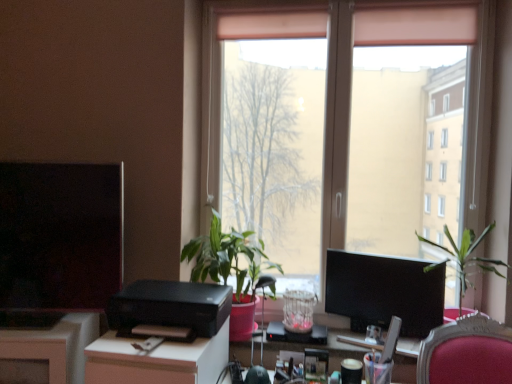
Locate an element on the screen. This screenshot has width=512, height=384. matte black monitor at left, which appears as the 2th computer monitor when viewed from the right is located at coordinates (60, 235).

Measure the distance between matte black monitor at center right, acting as the 1th computer monitor starting from the right, and camera.

matte black monitor at center right, acting as the 1th computer monitor starting from the right, and camera are 6.18 feet apart.

In order to face matte black monitor at center right, acting as the 1th computer monitor starting from the right, should I rotate leftwards or rightwards?

A 16.407 degree turn to the right will do.

Where is `green leafy plant at right, which is counted as the 2th houseplant, starting from the left`? green leafy plant at right, which is counted as the 2th houseplant, starting from the left is located at coordinates (465, 257).

The image size is (512, 384). What are the coordinates of `black plastic computer desk at center` in the screenshot? It's located at (320, 348).

What is the approximate height of black plastic computer desk at center?

The height of black plastic computer desk at center is 1.37 inches.

Locate an element on the screen. Image resolution: width=512 pixels, height=384 pixels. matte black monitor at left, which appears as the 2th computer monitor when viewed from the right is located at coordinates (60, 235).

Between matte black monitor at center right, which is the second computer monitor in left-to-right order, and green leafy plant at right, the 1th houseplant in the right-to-left sequence, which one has more height?

green leafy plant at right, the 1th houseplant in the right-to-left sequence, is taller.

Find the location of `the 1st computer monitor to the left of the green leafy plant at right, which is counted as the 2th houseplant, starting from the left, counting from the anchor's position`. the 1st computer monitor to the left of the green leafy plant at right, which is counted as the 2th houseplant, starting from the left, counting from the anchor's position is located at coordinates (385, 292).

Is matte black monitor at center right, which is the second computer monitor in left-to-right order, further to camera compared to green leafy plant at right, which is counted as the 2th houseplant, starting from the left?

Yes, matte black monitor at center right, which is the second computer monitor in left-to-right order, is further from the viewer.

From the image's perspective, between translucent glass vase at center and matte black monitor at center right, which is the second computer monitor in left-to-right order, which one is located above?

matte black monitor at center right, which is the second computer monitor in left-to-right order.

Is translucent glass vase at center placed right next to matte black monitor at center right, acting as the 1th computer monitor starting from the right?

They are not placed beside each other.

Which object is closer to the camera, translucent glass vase at center or matte black monitor at center right, which is the second computer monitor in left-to-right order?

Positioned in front is matte black monitor at center right, which is the second computer monitor in left-to-right order.

From a real-world perspective, does translucent glass vase at center stand above matte black monitor at center right, acting as the 1th computer monitor starting from the right?

No, from a real-world perspective, translucent glass vase at center is not over matte black monitor at center right, acting as the 1th computer monitor starting from the right

Between point (129, 363) and point (338, 355), which one is positioned behind?

The point (338, 355) is farther from the camera.

From a real-world perspective, is white glossy desk at center over black plastic computer desk at center?

No, from a real-world perspective, white glossy desk at center is not above black plastic computer desk at center.

Is white glossy desk at center positioned far away from black plastic computer desk at center?

No, there isn't a large distance between white glossy desk at center and black plastic computer desk at center.

Find the location of a particular element. The image size is (512, 384). desk on the left of the black plastic computer desk at center is located at coordinates (157, 360).

Where is `glass vase on the left of the black plastic computer desk at center`? glass vase on the left of the black plastic computer desk at center is located at coordinates (298, 310).

Does translucent glass vase at center appear on the left side of black plastic computer desk at center?

Indeed, translucent glass vase at center is positioned on the left side of black plastic computer desk at center.

Is translucent glass vase at center wider than black plastic computer desk at center?

In fact, translucent glass vase at center might be narrower than black plastic computer desk at center.

Would you say translucent glass vase at center is inside or outside black plastic computer desk at center?

translucent glass vase at center exists outside the volume of black plastic computer desk at center.

Is point (482, 260) positioned before point (32, 239)?

No, it is not.

Looking at this image, from a real-world perspective, which object stands above the other?

matte black monitor at left, the 1th computer monitor positioned from the left, from a real-world perspective.

Is green leafy plant at right, the 1th houseplant in the right-to-left sequence, not close to matte black monitor at left, the 1th computer monitor positioned from the left?

green leafy plant at right, the 1th houseplant in the right-to-left sequence, is positioned a significant distance from matte black monitor at left, the 1th computer monitor positioned from the left.

Locate an element on the screen. the 1st computer monitor behind the green leafy plant at right, which is counted as the 2th houseplant, starting from the left is located at coordinates (60, 235).

From a real-world perspective, is translucent glass vase at center on white glossy desk at center?

Correct, in the physical world, translucent glass vase at center is higher than white glossy desk at center.

From the image's perspective, would you say translucent glass vase at center is shown under white glossy desk at center?

No.

What's the angular difference between translucent glass vase at center and white glossy desk at center's facing directions?

The angle between the facing direction of translucent glass vase at center and the facing direction of white glossy desk at center is 0.737 degrees.

Looking at this image, is translucent glass vase at center facing towards white glossy desk at center?

No.

From the image's perspective, count 1st houseplants downward from the matte black monitor at left, the 1th computer monitor positioned from the left, and point to it. Please provide its 2D coordinates.

[(231, 269)]

How different are the orientations of green matte plant at center, placed as the second houseplant when sorted from right to left, and matte black monitor at left, the 1th computer monitor positioned from the left, in degrees?

There is a 14.7-degree angle between the facing directions of green matte plant at center, placed as the second houseplant when sorted from right to left, and matte black monitor at left, the 1th computer monitor positioned from the left.

From the image's perspective, is green matte plant at center, placed as the second houseplant when sorted from right to left, positioned above or below matte black monitor at left, the 1th computer monitor positioned from the left?

green matte plant at center, placed as the second houseplant when sorted from right to left, is below matte black monitor at left, the 1th computer monitor positioned from the left.

Considering the positions of point (237, 287) and point (96, 257), is point (237, 287) closer or farther from the camera than point (96, 257)?

Point (237, 287) appears to be farther away from the viewer than point (96, 257).

Identify the location of the 1st houseplant positioned above the matte black monitor at center right, which is the second computer monitor in left-to-right order (from the image's perspective). point(465,257).

The image size is (512, 384). I want to click on glass vase to the left of matte black monitor at center right, which is the second computer monitor in left-to-right order, so click(x=298, y=310).

When comparing their distances from green leafy plant at right, which is counted as the 2th houseplant, starting from the left, does white glossy desk at center or matte black monitor at center right, acting as the 1th computer monitor starting from the right, seem further?

white glossy desk at center lies further to green leafy plant at right, which is counted as the 2th houseplant, starting from the left, than the other object.

Estimate the real-world distances between objects in this image. Which object is further from black plastic printer at center, matte black monitor at left, the 1th computer monitor positioned from the left, or green matte plant at center, arranged as the first houseplant when viewed from the left?

The object further to black plastic printer at center is matte black monitor at left, the 1th computer monitor positioned from the left.

When comparing their distances from black plastic computer desk at center, does matte black monitor at center right, acting as the 1th computer monitor starting from the right, or black plastic printer at center seem closer?

Among the two, matte black monitor at center right, acting as the 1th computer monitor starting from the right, is located nearer to black plastic computer desk at center.

From the image, which object appears to be nearer to black plastic printer at center, green matte plant at center, arranged as the first houseplant when viewed from the left, or white glossy desk at center?

The object closer to black plastic printer at center is white glossy desk at center.

Estimate the real-world distances between objects in this image. Which object is closer to green leafy plant at right, the 1th houseplant in the right-to-left sequence, white glossy desk at center or matte black monitor at left, which appears as the 2th computer monitor when viewed from the right?

white glossy desk at center is closer to green leafy plant at right, the 1th houseplant in the right-to-left sequence.

Looking at the image, which one is located closer to transparent glass window at center, white glossy desk at center or translucent glass vase at center?

Among the two, translucent glass vase at center is located nearer to transparent glass window at center.

Estimate the real-world distances between objects in this image. Which object is further from green leafy plant at right, the 1th houseplant in the right-to-left sequence, green matte plant at center, placed as the second houseplant when sorted from right to left, or matte black monitor at center right, acting as the 1th computer monitor starting from the right?

Among the two, green matte plant at center, placed as the second houseplant when sorted from right to left, is located further to green leafy plant at right, the 1th houseplant in the right-to-left sequence.

Looking at the image, which one is located closer to green leafy plant at right, the 1th houseplant in the right-to-left sequence, translucent glass vase at center or black plastic printer at center?

translucent glass vase at center lies closer to green leafy plant at right, the 1th houseplant in the right-to-left sequence, than the other object.

Identify the location of printer between transparent glass window at center and black plastic computer desk at center from top to bottom. (170, 307).

The width and height of the screenshot is (512, 384). I want to click on desk located between matte black monitor at left, the 1th computer monitor positioned from the left, and translucent glass vase at center in the left-right direction, so click(x=157, y=360).

You are a GUI agent. You are given a task and a screenshot of the screen. Output one action in this format:
    pyautogui.click(x=<x>, y=<y>)
    Task: Click on the glass vase between transparent glass window at center and white glossy desk at center from top to bottom
    
    Given the screenshot: What is the action you would take?
    pyautogui.click(x=298, y=310)

At what (x,y) coordinates should I click in order to perform the action: click on window situated between matte black monitor at left, the 1th computer monitor positioned from the left, and matte black monitor at center right, acting as the 1th computer monitor starting from the right, from left to right. Please return your answer as a coordinate pair (x, y). The image size is (512, 384). Looking at the image, I should click on (348, 128).